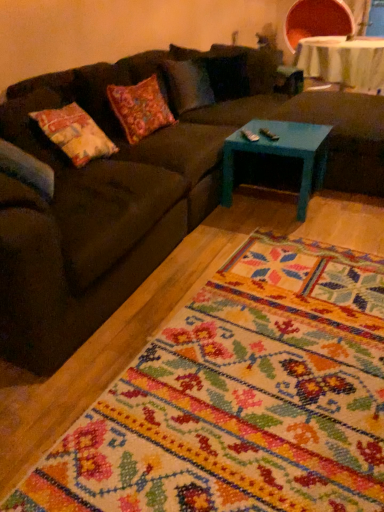
Question: Is teal painted wood footrest at center facing towards white fabric table at upper right?

Choices:
 (A) no
 (B) yes

Answer: (A)

Question: Is the position of teal painted wood footrest at center more distant than that of white fabric table at upper right?

Choices:
 (A) yes
 (B) no

Answer: (B)

Question: From the image's perspective, does teal painted wood footrest at center appear lower than white fabric table at upper right?

Choices:
 (A) yes
 (B) no

Answer: (A)

Question: Can you see teal painted wood footrest at center touching white fabric table at upper right?

Choices:
 (A) no
 (B) yes

Answer: (A)

Question: Does teal painted wood footrest at center appear on the left side of white fabric table at upper right?

Choices:
 (A) yes
 (B) no

Answer: (A)

Question: Considering the positions of floral carpet at center and white fabric table at upper right in the image, is floral carpet at center wider or thinner than white fabric table at upper right?

Choices:
 (A) wide
 (B) thin

Answer: (A)

Question: Is point click(269, 376) closer or farther from the camera than point click(329, 62)?

Choices:
 (A) farther
 (B) closer

Answer: (B)

Question: Would you say floral carpet at center is inside or outside white fabric table at upper right?

Choices:
 (A) outside
 (B) inside

Answer: (A)

Question: Relative to white fabric table at upper right, is floral carpet at center in front or behind?

Choices:
 (A) behind
 (B) front

Answer: (B)

Question: From a real-world perspective, relative to floral carpet at center, is teal painted wood footrest at center vertically above or below?

Choices:
 (A) above
 (B) below

Answer: (A)

Question: Considering their positions, is teal painted wood footrest at center located in front of or behind floral carpet at center?

Choices:
 (A) front
 (B) behind

Answer: (B)

Question: Is teal painted wood footrest at center bigger or smaller than floral carpet at center?

Choices:
 (A) small
 (B) big

Answer: (B)

Question: From the image's perspective, is teal painted wood footrest at center above or below floral carpet at center?

Choices:
 (A) above
 (B) below

Answer: (A)

Question: Is point pos(99,66) closer or farther from the camera than point pos(271,142)?

Choices:
 (A) farther
 (B) closer

Answer: (A)

Question: Based on their sizes in the image, would you say dark brown fabric couch at center is bigger or smaller than teal painted wood coffee table at center?

Choices:
 (A) big
 (B) small

Answer: (A)